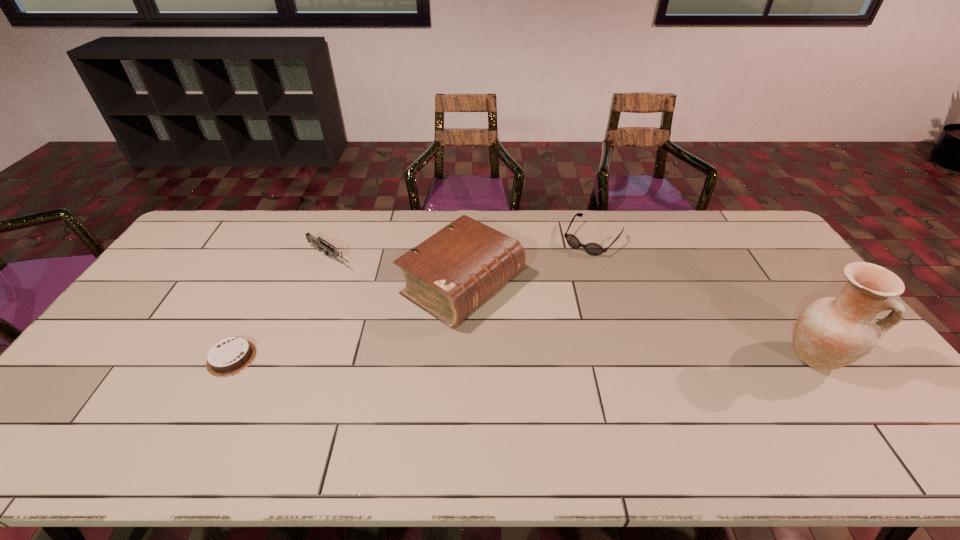
This screenshot has height=540, width=960. Find the location of `vacant space located 0.330m on the back of the chocolate cake`. vacant space located 0.330m on the back of the chocolate cake is located at coordinates (281, 263).

At what (x,y) coordinates should I click in order to perform the action: click on vacant area situated on the left of the tallest object. Please return your answer as a coordinate pair (x, y). This screenshot has width=960, height=540. Looking at the image, I should click on (664, 358).

You are a GUI agent. You are given a task and a screenshot of the screen. Output one action in this format:
    pyautogui.click(x=<x>, y=<y>)
    Task: Click on the free location located on the spine side of the Bible
    
    Given the screenshot: What is the action you would take?
    pyautogui.click(x=639, y=390)

Find the location of `vacant space positioned on the spine side of the Bible`. vacant space positioned on the spine side of the Bible is located at coordinates (580, 355).

At what (x,y) coordinates should I click in order to perform the action: click on vacant space located 0.180m on the spine side of the Bible. Please return your answer as a coordinate pair (x, y). Looking at the image, I should click on (564, 346).

In order to click on vacant space located 0.060m on the lenses of the fourth object from left to right in this screenshot , I will do `click(572, 264)`.

Where is `vacant space located on the lenses of the fourth object from left to right`? The image size is (960, 540). vacant space located on the lenses of the fourth object from left to right is located at coordinates (559, 281).

This screenshot has height=540, width=960. Find the location of `free space located 0.200m on the lenses of the fourth object from left to right`. free space located 0.200m on the lenses of the fourth object from left to right is located at coordinates (552, 288).

The image size is (960, 540). I want to click on free space located aimed along the barrel of the second object from left to right, so click(x=400, y=300).

Find the location of a particular element. This screenshot has width=960, height=540. vacant space positioned 0.090m aimed along the barrel of the second object from left to right is located at coordinates (366, 278).